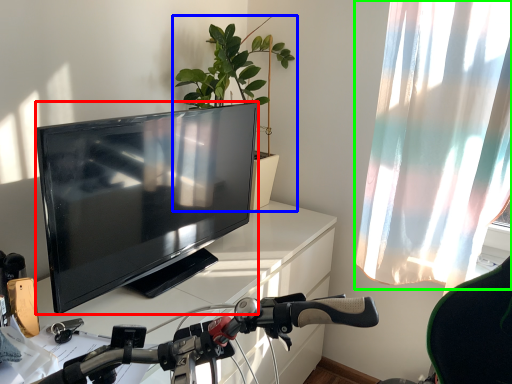
Question: Considering the real-world distances, which object is farthest from television (highlighted by a red box)? houseplant (highlighted by a blue box) or curtain (highlighted by a green box)?

Choices:
 (A) houseplant
 (B) curtain

Answer: (B)